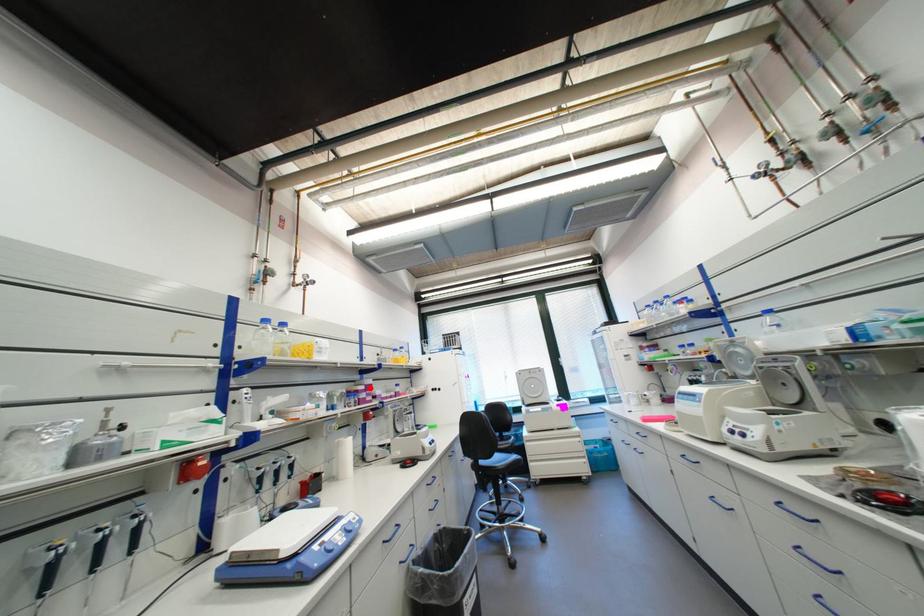
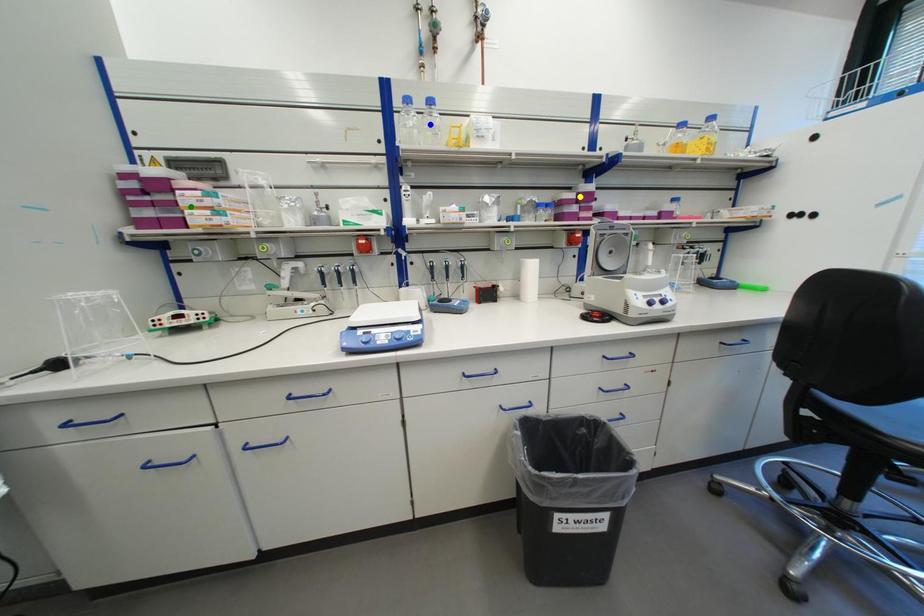
Question: I am providing you with two images of the same scene from different viewpoints. A red point is marked on the first image. You are given multiple points on the second image. Which mark in image 2 goes with the point in image 1?

Choices:
 (A) blue point
 (B) yellow point
 (C) green point

Answer: (B)